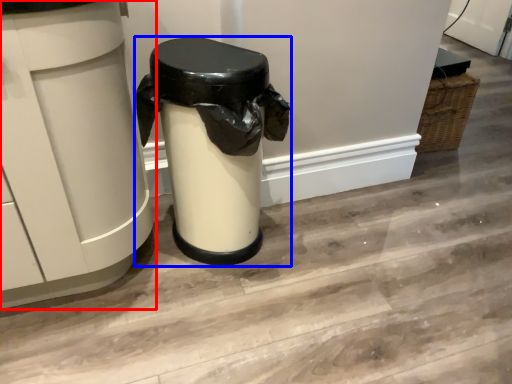
Question: Which of the following is the closest to the observer, waste container (highlighted by a red box) or waste container (highlighted by a blue box)?

Choices:
 (A) waste container
 (B) waste container

Answer: (A)